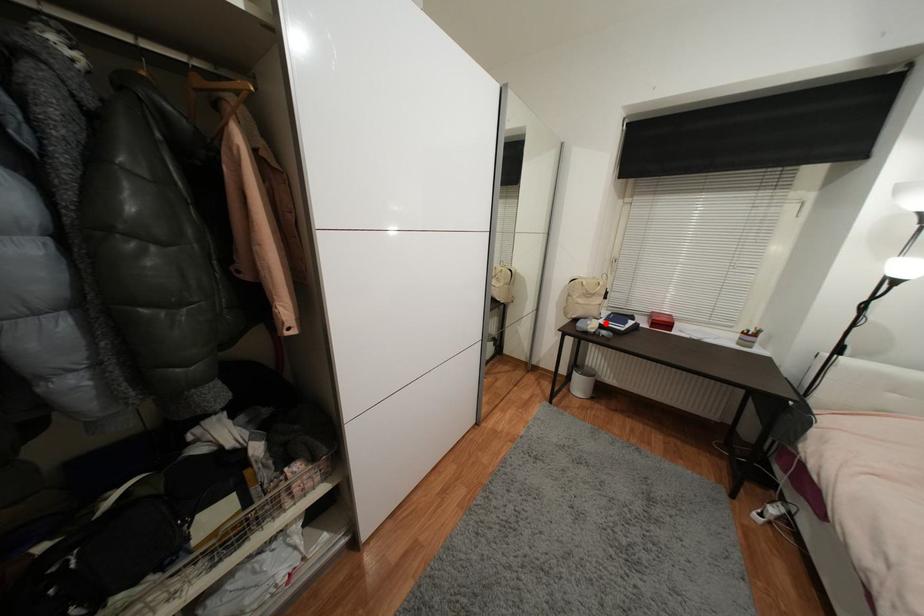
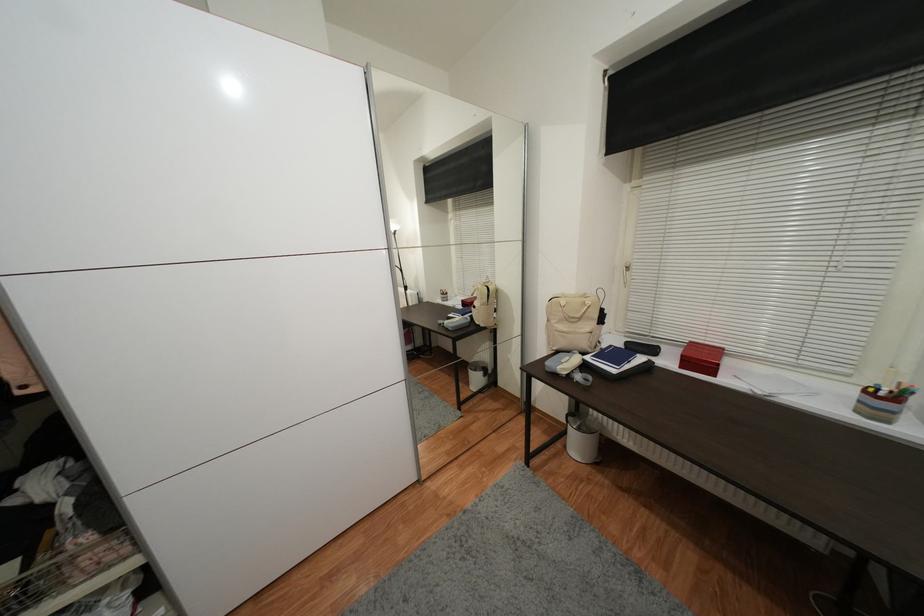
Locate, in the second image, the point that corresponds to the highlighted location in the first image.

(592, 360)